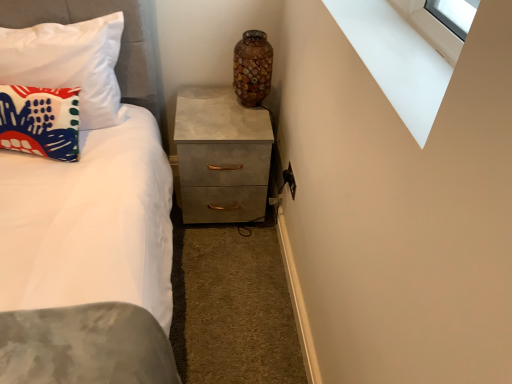
Question: From a real-world perspective, does matte fabric pillow at left, which is counted as the 2th pillow, starting from the top, sit lower than white smooth window sill at upper right?

Choices:
 (A) no
 (B) yes

Answer: (B)

Question: Is matte fabric pillow at left, which is counted as the 2th pillow, starting from the top, closer to the viewer compared to white smooth window sill at upper right?

Choices:
 (A) yes
 (B) no

Answer: (B)

Question: Is matte fabric pillow at left, which ranks as the 1th pillow in bottom-to-top order, taller than white smooth window sill at upper right?

Choices:
 (A) yes
 (B) no

Answer: (A)

Question: Considering the relative sizes of matte fabric pillow at left, which ranks as the 1th pillow in bottom-to-top order, and white smooth window sill at upper right in the image provided, is matte fabric pillow at left, which ranks as the 1th pillow in bottom-to-top order, wider than white smooth window sill at upper right?

Choices:
 (A) yes
 (B) no

Answer: (B)

Question: Is matte fabric pillow at left, which is counted as the 2th pillow, starting from the top, completely or partially outside of white smooth window sill at upper right?

Choices:
 (A) no
 (B) yes

Answer: (B)

Question: Is the depth of matte fabric pillow at left, which is counted as the 2th pillow, starting from the top, greater than that of white smooth window sill at upper right?

Choices:
 (A) yes
 (B) no

Answer: (A)

Question: From the image's perspective, is white smooth window sill at upper right located above matte fabric pillow at left, acting as the 2th pillow starting from the bottom?

Choices:
 (A) no
 (B) yes

Answer: (A)

Question: Is the position of white smooth window sill at upper right less distant than that of matte fabric pillow at left, acting as the 2th pillow starting from the bottom?

Choices:
 (A) no
 (B) yes

Answer: (B)

Question: Can you confirm if white smooth window sill at upper right is smaller than matte fabric pillow at left, acting as the 2th pillow starting from the bottom?

Choices:
 (A) no
 (B) yes

Answer: (B)

Question: Is white smooth window sill at upper right behind matte fabric pillow at left, acting as the first pillow starting from the top?

Choices:
 (A) yes
 (B) no

Answer: (B)

Question: Is white smooth window sill at upper right not close to matte fabric pillow at left, acting as the 2th pillow starting from the bottom?

Choices:
 (A) no
 (B) yes

Answer: (A)

Question: From the image's perspective, is white smooth window sill at upper right beneath matte fabric pillow at left, acting as the 2th pillow starting from the bottom?

Choices:
 (A) no
 (B) yes

Answer: (B)

Question: Does mosaic glass vase at upper center appear on the left side of white smooth window sill at upper right?

Choices:
 (A) yes
 (B) no

Answer: (A)